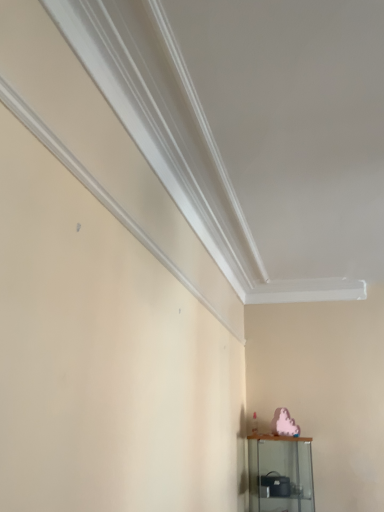
Question: Considering the positions of pink matte ghost at lower right and clear glass shelf at lower right in the image, is pink matte ghost at lower right bigger or smaller than clear glass shelf at lower right?

Choices:
 (A) small
 (B) big

Answer: (A)

Question: Is pink matte ghost at lower right taller or shorter than clear glass shelf at lower right?

Choices:
 (A) short
 (B) tall

Answer: (A)

Question: In the image, is pink matte ghost at lower right positioned in front of or behind clear glass shelf at lower right?

Choices:
 (A) behind
 (B) front

Answer: (A)

Question: From their relative heights in the image, would you say clear glass shelf at lower right is taller or shorter than pink matte ghost at lower right?

Choices:
 (A) short
 (B) tall

Answer: (B)

Question: From a real-world perspective, is clear glass shelf at lower right positioned above or below pink matte ghost at lower right?

Choices:
 (A) below
 (B) above

Answer: (A)

Question: Looking at the image, does clear glass shelf at lower right seem bigger or smaller compared to pink matte ghost at lower right?

Choices:
 (A) small
 (B) big

Answer: (B)

Question: Is clear glass shelf at lower right spatially inside pink matte ghost at lower right, or outside of it?

Choices:
 (A) inside
 (B) outside

Answer: (B)